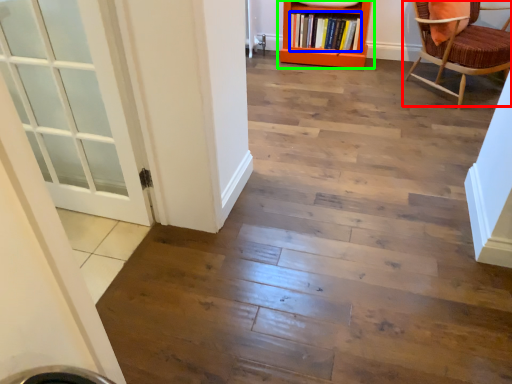
Question: Estimate the real-world distances between objects in this image. Which object is closer to chair (highlighted by a red box), book (highlighted by a blue box) or bookcase (highlighted by a green box)?

Choices:
 (A) book
 (B) bookcase

Answer: (B)